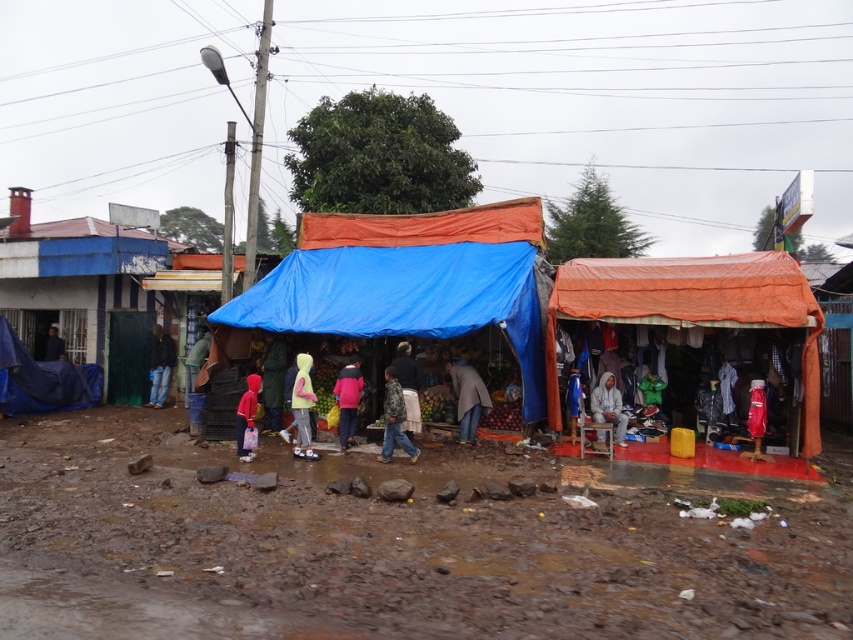
Is light gray fabric at center wider than green matte jacket at center?

In fact, light gray fabric at center might be narrower than green matte jacket at center.

Which is more to the left, light gray fabric at center or green matte jacket at center?

From the viewer's perspective, green matte jacket at center appears more on the left side.

Is point (602, 442) positioned in front of point (199, 342)?

Yes, it is in front of point (199, 342).

Where is `light gray fabric at center`? The image size is (853, 640). light gray fabric at center is located at coordinates pyautogui.click(x=608, y=406).

From the picture: Between camouflage-patterned jacket at center and light gray fabric at center, which one has more height?

camouflage-patterned jacket at center is taller.

Is point (392, 392) positioned in front of point (606, 420)?

Yes, point (392, 392) is in front of point (606, 420).

Which is in front, point (393, 397) or point (622, 424)?

Point (393, 397) is more forward.

Image resolution: width=853 pixels, height=640 pixels. I want to click on camouflage-patterned jacket at center, so click(393, 419).

Measure the distance between muddy ground at center and camera.

muddy ground at center and camera are 4.31 meters apart from each other.

Is point (117, 445) closer to camera compared to point (405, 394)?

No.

This screenshot has width=853, height=640. What do you see at coordinates (396, 547) in the screenshot?
I see `muddy ground at center` at bounding box center [396, 547].

What are the coordinates of `muddy ground at center` in the screenshot? It's located at (396, 547).